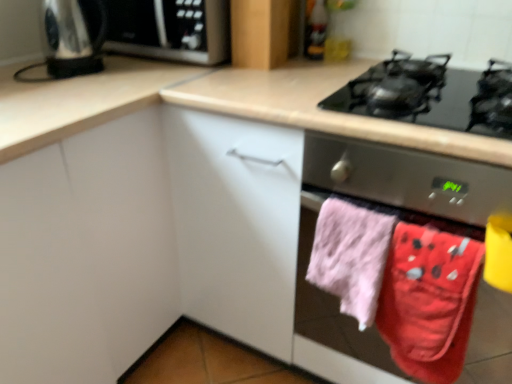
Question: In the image, is red cotton beach towel at lower right, acting as the second beach towel starting from the left, positioned in front of or behind black glass gas stove at upper right?

Choices:
 (A) front
 (B) behind

Answer: (B)

Question: In terms of height, does red cotton beach towel at lower right, arranged as the 1th beach towel when viewed from the right, look taller or shorter compared to black glass gas stove at upper right?

Choices:
 (A) short
 (B) tall

Answer: (B)

Question: Which object is the farthest from the shiny metallic kettle at upper left?

Choices:
 (A) pink fluffy towel at lower right, marked as the first beach towel in a left-to-right arrangement
 (B) white matte cabinet at center, the first cabinetry positioned from the left
 (C) black glass gas stove at upper right
 (D) red cotton beach towel at lower right, acting as the second beach towel starting from the left
 (E) pink fabric oven mitts at lower right

Answer: (D)

Question: Which is nearer to the pink fluffy towel at lower right, which is the 2th beach towel in right-to-left order?

Choices:
 (A) pink fabric oven mitts at lower right
 (B) white matte cabinet at center, the first cabinetry positioned from the left
 (C) red cotton beach towel at lower right, arranged as the 1th beach towel when viewed from the right
 (D) matte wood cabinet at upper center, placed as the 1th cabinetry when sorted from right to left
 (E) satin silver microwave at upper left

Answer: (A)